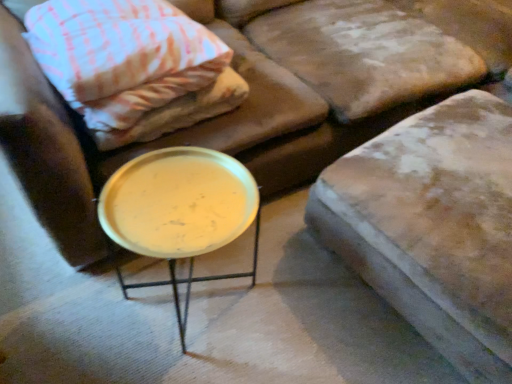
Question: Does pink woven fabric pillow at upper left have a larger size compared to leather cushion at upper right?

Choices:
 (A) yes
 (B) no

Answer: (B)

Question: Is pink woven fabric pillow at upper left facing towards leather cushion at upper right?

Choices:
 (A) no
 (B) yes

Answer: (A)

Question: Can leather cushion at upper right be found inside pink woven fabric pillow at upper left?

Choices:
 (A) yes
 (B) no

Answer: (B)

Question: From a real-world perspective, is pink woven fabric pillow at upper left over leather cushion at upper right?

Choices:
 (A) no
 (B) yes

Answer: (B)

Question: Does pink woven fabric pillow at upper left appear on the right side of leather cushion at upper right?

Choices:
 (A) yes
 (B) no

Answer: (B)

Question: Considering the positions of leather cushion at upper right and pink woven fabric pillow at upper left in the image, is leather cushion at upper right taller or shorter than pink woven fabric pillow at upper left?

Choices:
 (A) tall
 (B) short

Answer: (A)

Question: From a real-world perspective, is leather cushion at upper right above or below pink woven fabric pillow at upper left?

Choices:
 (A) below
 (B) above

Answer: (A)

Question: In the image, is leather cushion at upper right on the left side or the right side of pink woven fabric pillow at upper left?

Choices:
 (A) left
 (B) right

Answer: (B)

Question: Considering their positions, is leather cushion at upper right located in front of or behind pink woven fabric pillow at upper left?

Choices:
 (A) front
 (B) behind

Answer: (A)

Question: Is point (133, 102) positioned closer to the camera than point (458, 211)?

Choices:
 (A) closer
 (B) farther

Answer: (B)

Question: Visually, is pink woven fabric pillow at upper left positioned to the left or to the right of leather cushion at upper right?

Choices:
 (A) right
 (B) left

Answer: (B)

Question: From a real-world perspective, is pink woven fabric pillow at upper left physically located above or below leather cushion at upper right?

Choices:
 (A) below
 (B) above

Answer: (B)

Question: Is pink woven fabric pillow at upper left inside or outside of leather cushion at upper right?

Choices:
 (A) outside
 (B) inside

Answer: (A)

Question: Based on their sizes in the image, would you say pink woven fabric pillow at upper left is bigger or smaller than metallic gold tray at center?

Choices:
 (A) big
 (B) small

Answer: (B)

Question: From a real-world perspective, relative to metallic gold tray at center, is pink woven fabric pillow at upper left vertically above or below?

Choices:
 (A) above
 (B) below

Answer: (A)